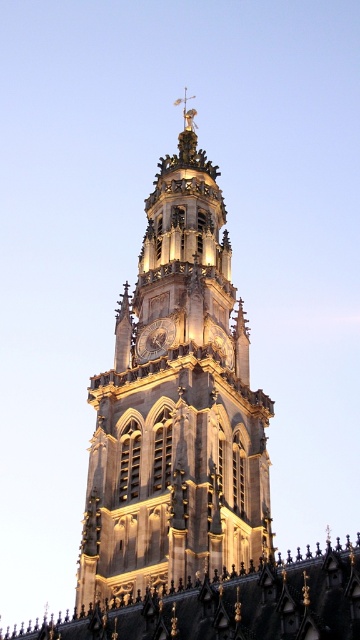
Between golden stone tower at center and golden metallic clock at center, which one appears on the right side from the viewer's perspective?

golden stone tower at center

Is the position of golden stone tower at center more distant than that of golden metallic clock at center?

No, it is not.

The image size is (360, 640). What are the coordinates of `golden stone tower at center` in the screenshot? It's located at (177, 406).

In order to click on golden stone tower at center in this screenshot , I will do `click(177, 406)`.